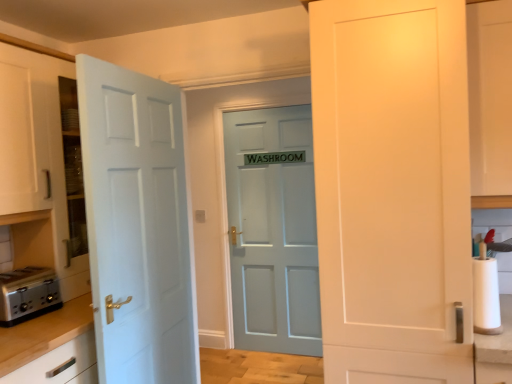
This screenshot has height=384, width=512. I want to click on vacant area to the right of silver metallic toaster at lower left, so click(x=64, y=312).